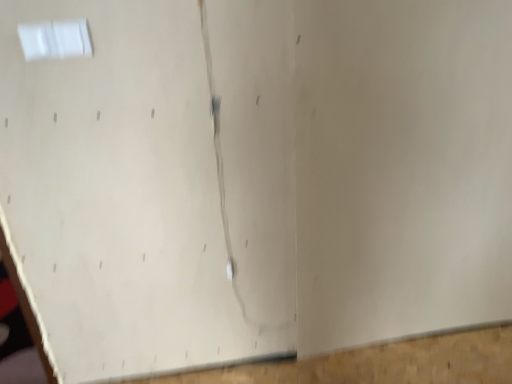
Question: In the image, is wooden at bottom positioned in front of or behind white plastic window at upper left?

Choices:
 (A) behind
 (B) front

Answer: (A)

Question: Considering the positions of wooden at bottom and white plastic window at upper left in the image, is wooden at bottom bigger or smaller than white plastic window at upper left?

Choices:
 (A) small
 (B) big

Answer: (B)

Question: Would you say wooden at bottom is to the left or to the right of white plastic window at upper left in the picture?

Choices:
 (A) right
 (B) left

Answer: (A)

Question: In terms of width, does white plastic window at upper left look wider or thinner when compared to wooden at bottom?

Choices:
 (A) thin
 (B) wide

Answer: (A)

Question: From their relative heights in the image, would you say white plastic window at upper left is taller or shorter than wooden at bottom?

Choices:
 (A) short
 (B) tall

Answer: (B)

Question: From a real-world perspective, is white plastic window at upper left physically located above or below wooden at bottom?

Choices:
 (A) below
 (B) above

Answer: (B)

Question: In terms of size, does white plastic window at upper left appear bigger or smaller than wooden at bottom?

Choices:
 (A) big
 (B) small

Answer: (B)